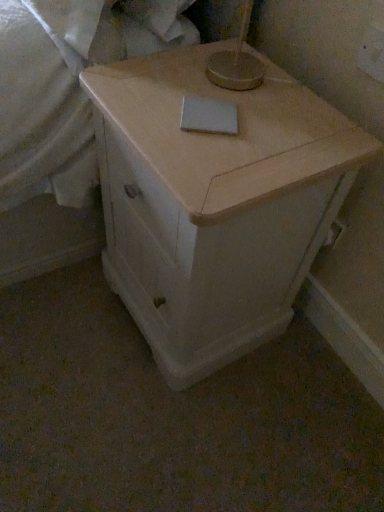
Question: Relative to white matte sheet at upper center, is light wood cabinet at center in front or behind?

Choices:
 (A) front
 (B) behind

Answer: (A)

Question: In terms of width, does light wood cabinet at center look wider or thinner when compared to white matte sheet at upper center?

Choices:
 (A) thin
 (B) wide

Answer: (B)

Question: Which object is the farthest from the light wood cabinet at center?

Choices:
 (A) white matte notepad at center
 (B) white matte sheet at upper center

Answer: (B)

Question: Which object is the closest to the light wood cabinet at center?

Choices:
 (A) white matte notepad at center
 (B) white matte sheet at upper center

Answer: (A)